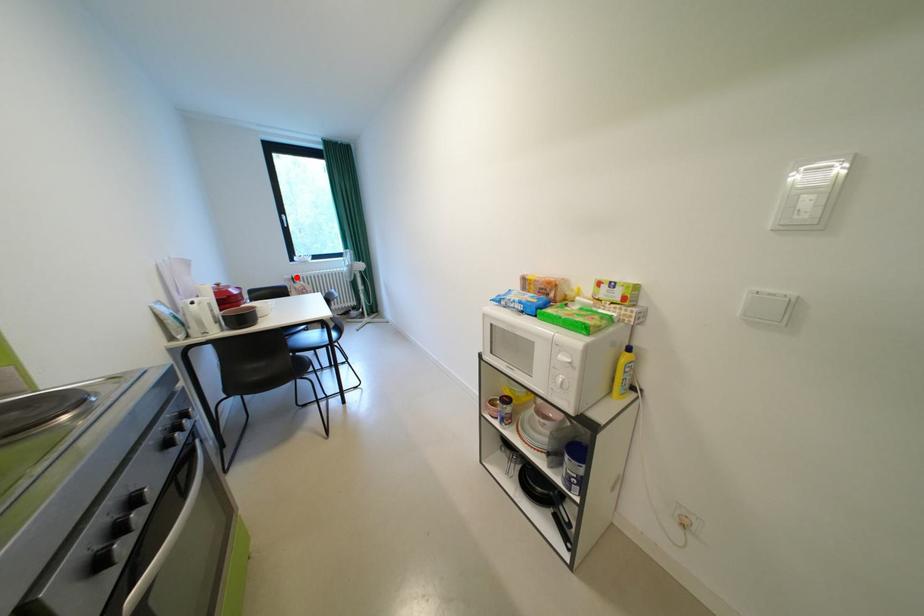
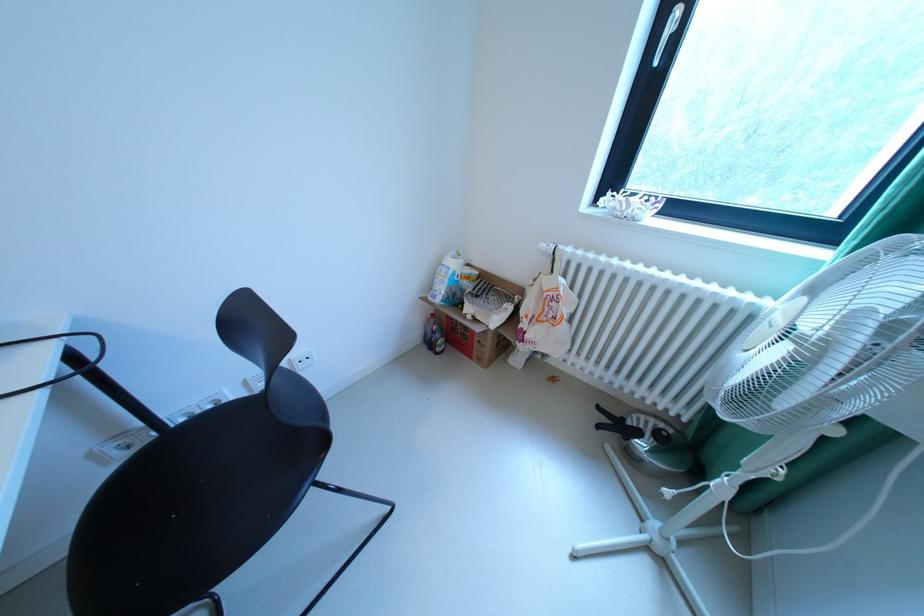
Question: I am providing you with two images of the same scene from different viewpoints. A red point is shown in image1. For the corresponding object point in image2, is it positioned nearer or farther from the camera?

Choices:
 (A) Nearer
 (B) Farther

Answer: (A)